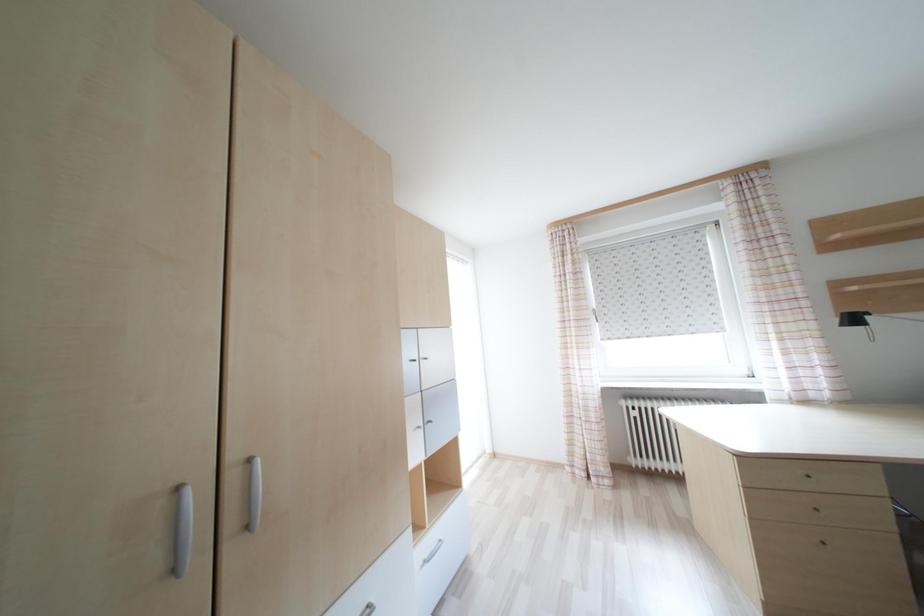
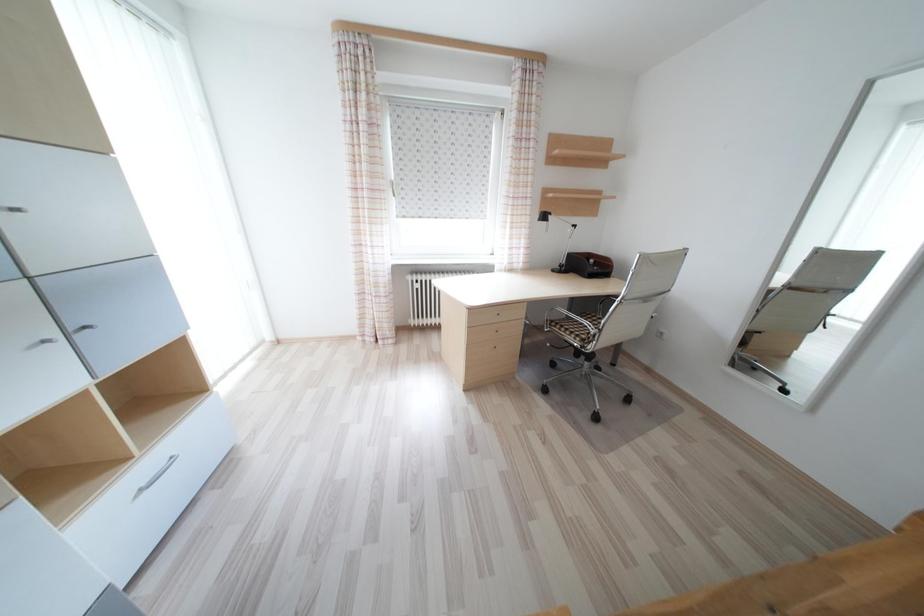
First-person continuous shooting, in which direction is the camera rotating?

The rotation direction of the camera is right-down.